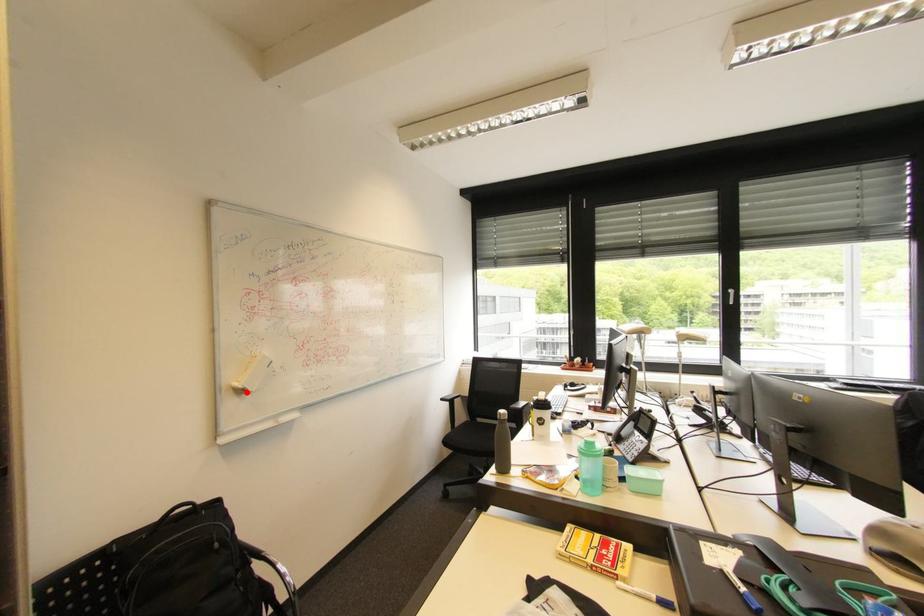
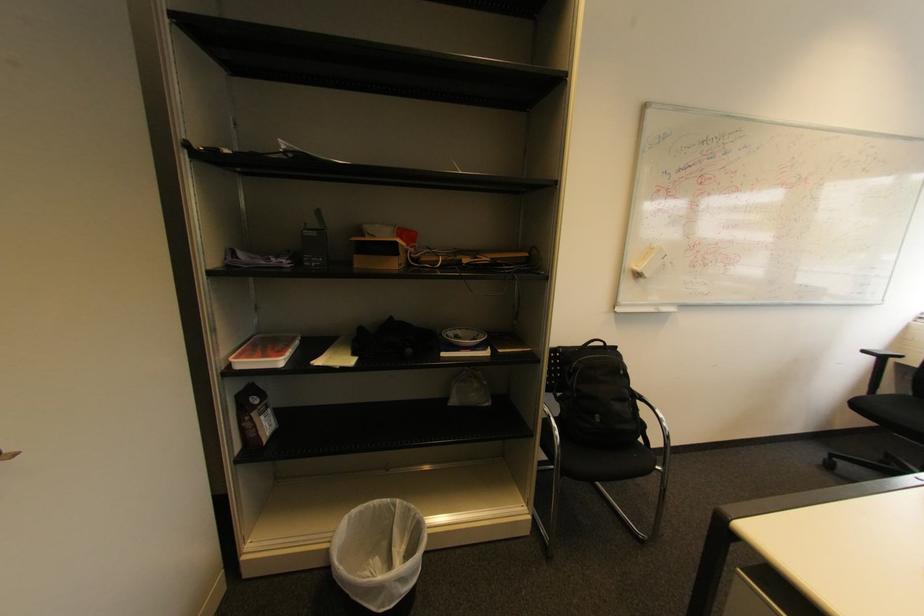
In the second image, find the point that corresponds to the highlighted location in the first image.

(643, 276)